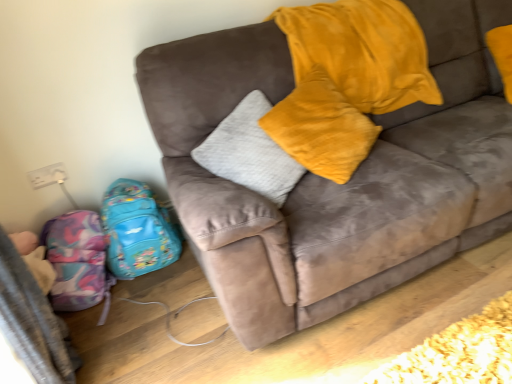
Find the location of a particular element. This screenshot has height=384, width=512. shiny blue backpack at lower left, which ranks as the 1th luggage in right-to-left order is located at coordinates (137, 230).

This screenshot has height=384, width=512. Describe the element at coordinates (77, 260) in the screenshot. I see `multicolored fabric backpack at lower left, placed as the first luggage when sorted from left to right` at that location.

Identify the location of velvet yellow pillow at upper center. The width and height of the screenshot is (512, 384). (321, 128).

Locate an element on the screen. The height and width of the screenshot is (384, 512). shiny blue backpack at lower left, which ranks as the 1th luggage in right-to-left order is located at coordinates (137, 230).

Could you tell me if suede couch at center is facing shiny blue backpack at lower left, which ranks as the 1th luggage in right-to-left order?

No, suede couch at center is not turned towards shiny blue backpack at lower left, which ranks as the 1th luggage in right-to-left order.

Which of these two, suede couch at center or shiny blue backpack at lower left, which ranks as the 1th luggage in right-to-left order, is wider?

suede couch at center is wider.

Is suede couch at center at the right side of shiny blue backpack at lower left, which is counted as the 2th luggage, starting from the left?

Indeed, suede couch at center is positioned on the right side of shiny blue backpack at lower left, which is counted as the 2th luggage, starting from the left.

From a real-world perspective, is suede couch at center above or below shiny blue backpack at lower left, which ranks as the 1th luggage in right-to-left order?

From a real-world perspective, suede couch at center is physically above shiny blue backpack at lower left, which ranks as the 1th luggage in right-to-left order.

Which is in front, point (90, 230) or point (119, 182)?

The point (90, 230) is closer to the camera.

Which object is closer to the camera, multicolored fabric backpack at lower left, the second luggage in the right-to-left sequence, or shiny blue backpack at lower left, which ranks as the 1th luggage in right-to-left order?

Positioned in front is multicolored fabric backpack at lower left, the second luggage in the right-to-left sequence.

From the picture: From the image's perspective, is suede couch at center above or below velvet yellow pillow at upper center?

suede couch at center is below velvet yellow pillow at upper center.

Does suede couch at center have a smaller size compared to velvet yellow pillow at upper center?

No, suede couch at center is not smaller than velvet yellow pillow at upper center.

From a real-world perspective, is suede couch at center above or below velvet yellow pillow at upper center?

suede couch at center is situated lower than velvet yellow pillow at upper center in the real world.

Can you confirm if suede couch at center is positioned to the right of velvet yellow pillow at upper center?

Yes, suede couch at center is to the right of velvet yellow pillow at upper center.

Would you say multicolored fabric backpack at lower left, placed as the first luggage when sorted from left to right, is part of suede couch at center's contents?

No, multicolored fabric backpack at lower left, placed as the first luggage when sorted from left to right, is located outside of suede couch at center.

Can you tell me how much suede couch at center and multicolored fabric backpack at lower left, the second luggage in the right-to-left sequence, differ in facing direction?

suede couch at center and multicolored fabric backpack at lower left, the second luggage in the right-to-left sequence, are facing 2.76 degrees away from each other.

Considering the sizes of objects suede couch at center and multicolored fabric backpack at lower left, placed as the first luggage when sorted from left to right, in the image provided, who is taller, suede couch at center or multicolored fabric backpack at lower left, placed as the first luggage when sorted from left to right,?

Standing taller between the two is suede couch at center.

At what (x,y) coordinates should I click in order to perform the action: click on luggage that is the 1st object located behind the suede couch at center. Please return your answer as a coordinate pair (x, y). Image resolution: width=512 pixels, height=384 pixels. Looking at the image, I should click on tap(77, 260).

Can you confirm if velvet yellow pillow at upper center is thinner than multicolored fabric backpack at lower left, the second luggage in the right-to-left sequence?

Correct, the width of velvet yellow pillow at upper center is less than that of multicolored fabric backpack at lower left, the second luggage in the right-to-left sequence.

Is velvet yellow pillow at upper center oriented away from multicolored fabric backpack at lower left, placed as the first luggage when sorted from left to right?

Yes, multicolored fabric backpack at lower left, placed as the first luggage when sorted from left to right, is at the back of velvet yellow pillow at upper center.

Is velvet yellow pillow at upper center not close to multicolored fabric backpack at lower left, placed as the first luggage when sorted from left to right?

Yes, velvet yellow pillow at upper center is far from multicolored fabric backpack at lower left, placed as the first luggage when sorted from left to right.

Which is in front, velvet yellow pillow at upper center or multicolored fabric backpack at lower left, placed as the first luggage when sorted from left to right?

→ velvet yellow pillow at upper center is closer to the camera.

Identify the location of studio couch that is under the velvet yellow pillow at upper center (from a real-world perspective). The image size is (512, 384). (331, 181).

From a real-world perspective, is velvet yellow pillow at upper center above or below suede couch at center?

velvet yellow pillow at upper center is above suede couch at center.

Is the depth of velvet yellow pillow at upper center greater than that of suede couch at center?

Yes, velvet yellow pillow at upper center is further from the camera.

Is velvet yellow pillow at upper center bigger than suede couch at center?

No.

Considering the relative positions of multicolored fabric backpack at lower left, the second luggage in the right-to-left sequence, and velvet yellow pillow at upper center in the image provided, is multicolored fabric backpack at lower left, the second luggage in the right-to-left sequence, to the left of velvet yellow pillow at upper center from the viewer's perspective?

Correct, you'll find multicolored fabric backpack at lower left, the second luggage in the right-to-left sequence, to the left of velvet yellow pillow at upper center.

Which object is wider, multicolored fabric backpack at lower left, the second luggage in the right-to-left sequence, or velvet yellow pillow at upper center?

Wider between the two is multicolored fabric backpack at lower left, the second luggage in the right-to-left sequence.

Considering the relative positions of multicolored fabric backpack at lower left, the second luggage in the right-to-left sequence, and velvet yellow pillow at upper center in the image provided, is multicolored fabric backpack at lower left, the second luggage in the right-to-left sequence, behind velvet yellow pillow at upper center?

Yes, it is behind velvet yellow pillow at upper center.

Find the location of a particular element. Image resolution: width=512 pixels, height=384 pixels. luggage that is the 1st one when counting downward from the suede couch at center (from the image's perspective) is located at coordinates (137, 230).

Locate an element on the screen. The image size is (512, 384). luggage above the multicolored fabric backpack at lower left, placed as the first luggage when sorted from left to right (from the image's perspective) is located at coordinates (137, 230).

Consider the image. Based on their spatial positions, is velvet yellow pillow at upper center or multicolored fabric backpack at lower left, placed as the first luggage when sorted from left to right, further from suede couch at center?

Among the two, multicolored fabric backpack at lower left, placed as the first luggage when sorted from left to right, is located further to suede couch at center.

Estimate the real-world distances between objects in this image. Which object is closer to suede couch at center, multicolored fabric backpack at lower left, placed as the first luggage when sorted from left to right, or shiny blue backpack at lower left, which is counted as the 2th luggage, starting from the left?

Among the two, shiny blue backpack at lower left, which is counted as the 2th luggage, starting from the left, is located nearer to suede couch at center.

From the image, which object appears to be farther from multicolored fabric backpack at lower left, the second luggage in the right-to-left sequence, velvet yellow pillow at upper center or suede couch at center?

velvet yellow pillow at upper center is further to multicolored fabric backpack at lower left, the second luggage in the right-to-left sequence.

When comparing their distances from multicolored fabric backpack at lower left, placed as the first luggage when sorted from left to right, does shiny blue backpack at lower left, which is counted as the 2th luggage, starting from the left, or suede couch at center seem closer?

shiny blue backpack at lower left, which is counted as the 2th luggage, starting from the left, lies closer to multicolored fabric backpack at lower left, placed as the first luggage when sorted from left to right, than the other object.

Estimate the real-world distances between objects in this image. Which object is closer to velvet yellow pillow at upper center, shiny blue backpack at lower left, which is counted as the 2th luggage, starting from the left, or suede couch at center?

suede couch at center lies closer to velvet yellow pillow at upper center than the other object.

Considering their positions, is velvet yellow pillow at upper center positioned further to shiny blue backpack at lower left, which ranks as the 1th luggage in right-to-left order, than suede couch at center?

velvet yellow pillow at upper center lies further to shiny blue backpack at lower left, which ranks as the 1th luggage in right-to-left order, than the other object.

Considering their positions, is multicolored fabric backpack at lower left, placed as the first luggage when sorted from left to right, positioned closer to shiny blue backpack at lower left, which ranks as the 1th luggage in right-to-left order, than suede couch at center?

multicolored fabric backpack at lower left, placed as the first luggage when sorted from left to right, is positioned closer to the anchor shiny blue backpack at lower left, which ranks as the 1th luggage in right-to-left order.

Which object lies nearer to the anchor point multicolored fabric backpack at lower left, placed as the first luggage when sorted from left to right, shiny blue backpack at lower left, which ranks as the 1th luggage in right-to-left order, or velvet yellow pillow at upper center?

Among the two, shiny blue backpack at lower left, which ranks as the 1th luggage in right-to-left order, is located nearer to multicolored fabric backpack at lower left, placed as the first luggage when sorted from left to right.

At what (x,y) coordinates should I click in order to perform the action: click on pillow between suede couch at center and shiny blue backpack at lower left, which is counted as the 2th luggage, starting from the left, in the front-back direction. Please return your answer as a coordinate pair (x, y). Looking at the image, I should click on (321, 128).

Identify the location of luggage between multicolored fabric backpack at lower left, the second luggage in the right-to-left sequence, and velvet yellow pillow at upper center. This screenshot has height=384, width=512. (137, 230).

You are a GUI agent. You are given a task and a screenshot of the screen. Output one action in this format:
    pyautogui.click(x=<x>, y=<y>)
    Task: Click on the luggage between suede couch at center and shiny blue backpack at lower left, which ranks as the 1th luggage in right-to-left order, in the front-back direction
    The height and width of the screenshot is (384, 512).
    Given the screenshot: What is the action you would take?
    pyautogui.click(x=77, y=260)

You are a GUI agent. You are given a task and a screenshot of the screen. Output one action in this format:
    pyautogui.click(x=<x>, y=<y>)
    Task: Click on the pillow between suede couch at center and multicolored fabric backpack at lower left, the second luggage in the right-to-left sequence, in the front-back direction
    The width and height of the screenshot is (512, 384).
    Given the screenshot: What is the action you would take?
    pyautogui.click(x=321, y=128)